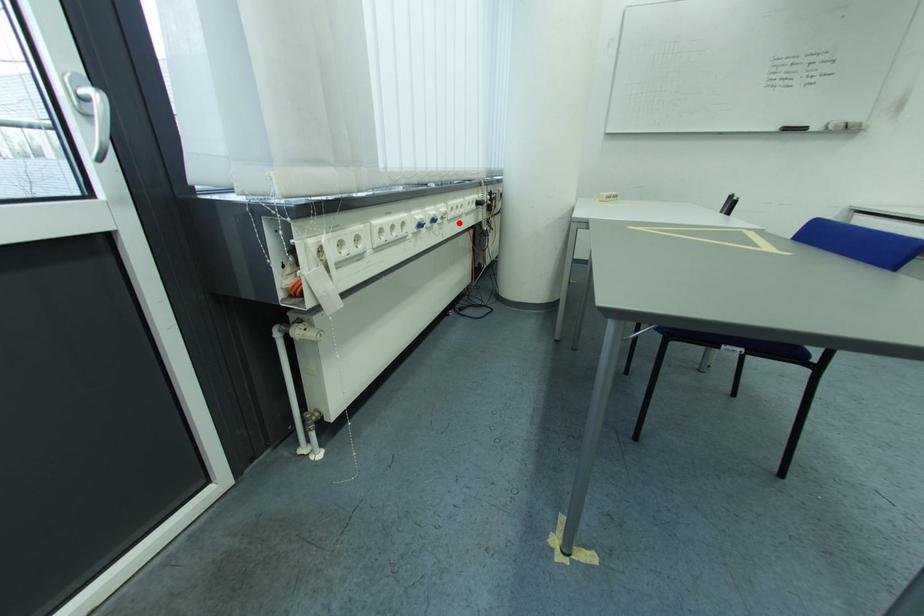
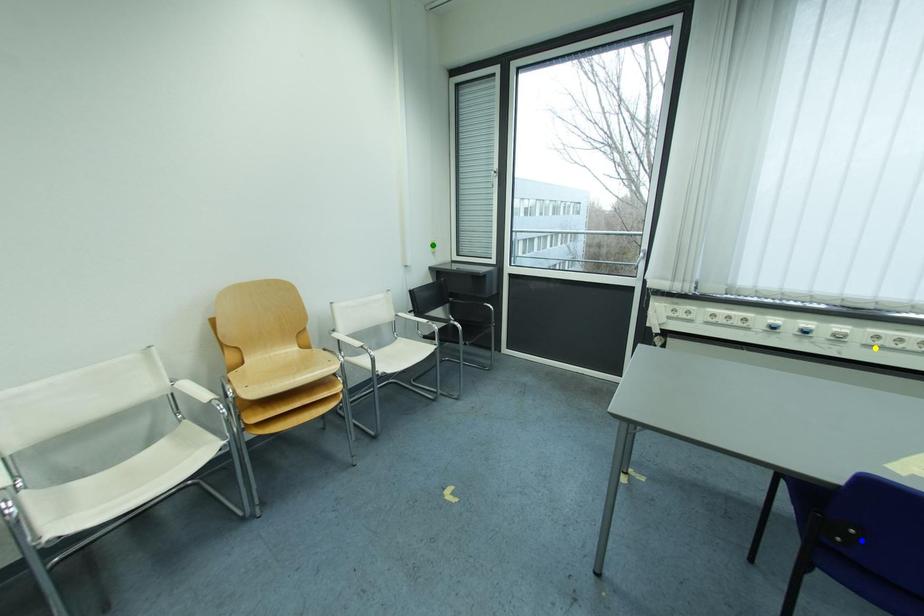
Question: I am providing you with two images of the same scene from different viewpoints. A red point is marked on the first image. You are given multiple points on the second image. Which spot in image 2 lines up with the point in image 1?

Choices:
 (A) green point
 (B) blue point
 (C) yellow point

Answer: (C)